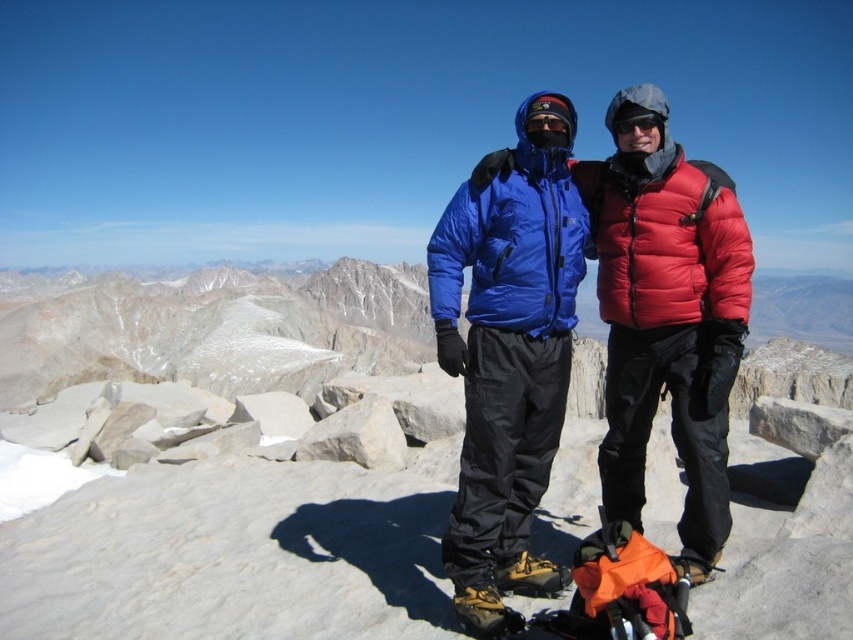
You are a photographer planning to capture a wide shot of the matte blue jacket at center and the black matte goggles at center. Given that your camera can only focus on objects within a 1.5 meter width, will both items fit within the frame?

The matte blue jacket at center is wider than the black matte goggles at center. Since the camera can focus on objects within a 1.5 meter width, both items can fit within the frame as long as their combined width does not exceed 1.5 meters. However, the exact fit depends on their individual sizes and positioning.

You are a photographer trying to take a picture of the matte blue jacket at center and the black matte goggles at center. Since both are at the center, how can you determine their positions relative to each other in the photo?

The matte blue jacket at center is to the right of the black matte goggles at center, so in the photo, the matte blue jacket at center will appear to the right side of the black matte goggles at center.